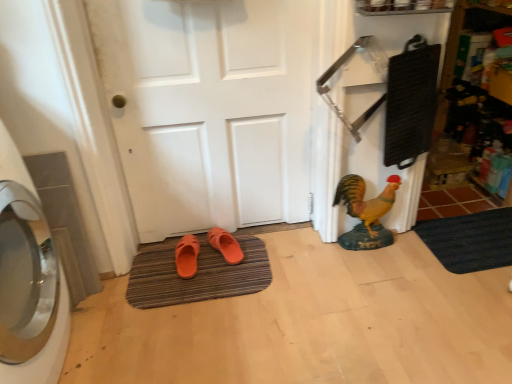
Identify the location of vacant space in shiny yellow statue at right (from a real-world perspective). (364, 248).